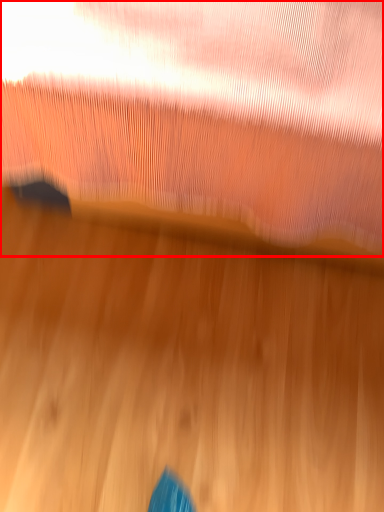
Question: In this image, where is curtain (annotated by the red box) located relative to wood?

Choices:
 (A) left
 (B) right

Answer: (B)